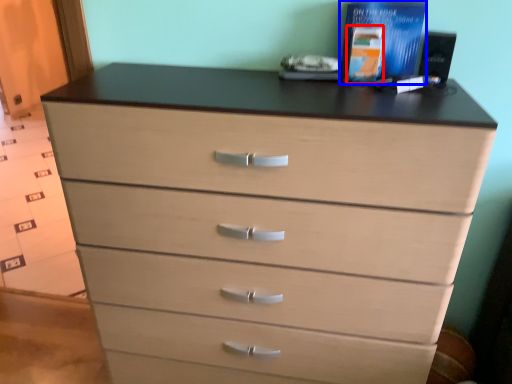
Question: Which object appears closest to the camera in this image, book (highlighted by a red box) or book (highlighted by a blue box)?

Choices:
 (A) book
 (B) book

Answer: (B)